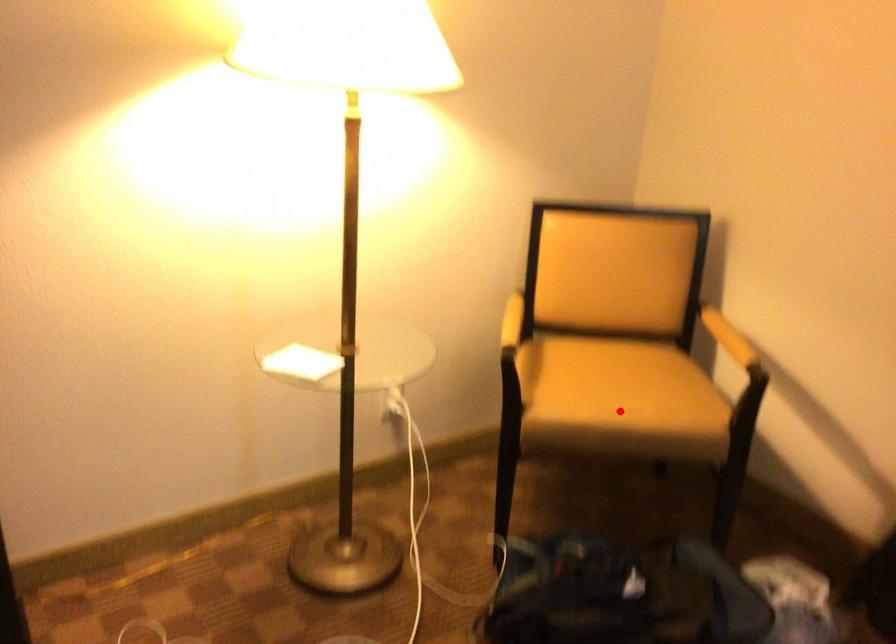
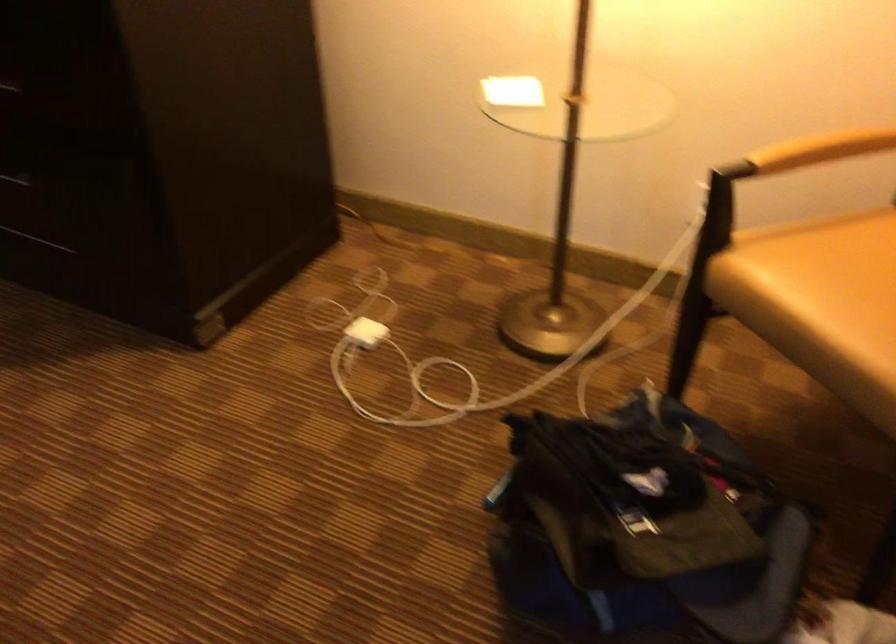
In the second image, find the point that corresponds to the highlighted location in the first image.

(821, 303)